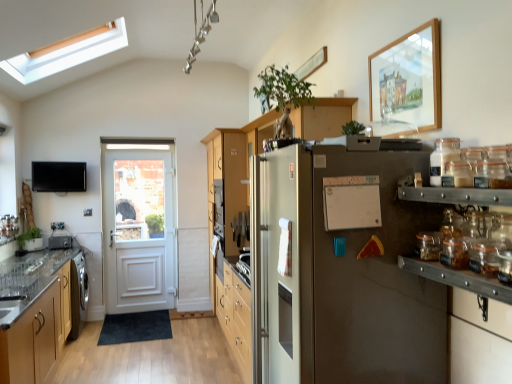
This screenshot has width=512, height=384. In order to click on wooden cabinet at left in this screenshot , I will do `click(35, 315)`.

What do you see at coordinates (429, 245) in the screenshot? This screenshot has height=384, width=512. I see `clear glass jar at right, which is counted as the 1th glass jar, starting from the bottom` at bounding box center [429, 245].

Locate an element on the screen. The height and width of the screenshot is (384, 512). wooden picture frame at upper right is located at coordinates (407, 82).

What do you see at coordinates (343, 272) in the screenshot? Image resolution: width=512 pixels, height=384 pixels. I see `satin silver refrigerator at center` at bounding box center [343, 272].

You are a GUI agent. You are given a task and a screenshot of the screen. Output one action in this format:
    pyautogui.click(x=<x>, y=<y>)
    Task: Click on the metallic silver toaster at left
    The image size is (512, 384).
    Given the screenshot: What is the action you would take?
    pyautogui.click(x=60, y=242)

Between clear glass jar at right, the second glass jar in the top-to-bottom sequence, and wooden cabinet at left, which one has larger size?

wooden cabinet at left is bigger.

Is clear glass jar at right, the second glass jar in the top-to-bottom sequence, facing away from wooden cabinet at left?

No, clear glass jar at right, the second glass jar in the top-to-bottom sequence, is not facing away from wooden cabinet at left.

Is clear glass jar at right, which is counted as the 1th glass jar, starting from the bottom, positioned far away from wooden cabinet at left?

Yes.

From their relative heights in the image, would you say clear glass jar at right, which is counted as the 1th glass jar, starting from the bottom, is taller or shorter than wooden cabinet at left?

In the image, clear glass jar at right, which is counted as the 1th glass jar, starting from the bottom, appears to be shorter than wooden cabinet at left.

Looking at their sizes, would you say white matte bulletin board at center is wider or thinner than clear glass door at left?

white matte bulletin board at center is thinner than clear glass door at left.

Considering the positions of objects white matte bulletin board at center and clear glass door at left in the image provided, who is behind, white matte bulletin board at center or clear glass door at left?

Positioned behind is clear glass door at left.

From a real-world perspective, who is located lower, white matte bulletin board at center or clear glass door at left?

clear glass door at left.

Considering the relative sizes of clear glass jar at right, which is counted as the 1th glass jar, starting from the bottom, and green matte plant at left in the image provided, is clear glass jar at right, which is counted as the 1th glass jar, starting from the bottom, wider than green matte plant at left?

In fact, clear glass jar at right, which is counted as the 1th glass jar, starting from the bottom, might be narrower than green matte plant at left.

Which point is more distant from viewer, (432, 247) or (27, 234)?

The point (27, 234) is farther.

Considering the sizes of clear glass jar at right, the second glass jar in the top-to-bottom sequence, and green matte plant at left in the image, is clear glass jar at right, the second glass jar in the top-to-bottom sequence, taller or shorter than green matte plant at left?

Clearly, clear glass jar at right, the second glass jar in the top-to-bottom sequence, is shorter compared to green matte plant at left.

Considering the relative sizes of wooden cabinet at left and green matte plant at left in the image provided, is wooden cabinet at left smaller than green matte plant at left?

No.

In the scene shown: Is wooden cabinet at left not near green matte plant at left?

wooden cabinet at left is positioned a significant distance from green matte plant at left.

Which object is further away from the camera, wooden cabinet at left or green matte plant at left?

green matte plant at left is behind.

Is green matte plant at left a part of wooden cabinet at left?

No, wooden cabinet at left does not contain green matte plant at left.

Is wooden picture frame at upper right not near clear glass door at left?

Absolutely, wooden picture frame at upper right is distant from clear glass door at left.

Can you confirm if wooden picture frame at upper right is taller than clear glass door at left?

In fact, wooden picture frame at upper right may be shorter than clear glass door at left.

Considering the sizes of wooden picture frame at upper right and clear glass door at left in the image, is wooden picture frame at upper right wider or thinner than clear glass door at left?

Clearly, wooden picture frame at upper right has less width compared to clear glass door at left.

Which is more to the left, wooden picture frame at upper right or clear glass door at left?

clear glass door at left is more to the left.

From the image's perspective, is satin silver refrigerator at center beneath wooden cabinet at left?

No, from the image's perspective, satin silver refrigerator at center is not beneath wooden cabinet at left.

From a real-world perspective, relative to wooden cabinet at left, is satin silver refrigerator at center vertically above or below?

satin silver refrigerator at center is situated higher than wooden cabinet at left in the real world.

Considering the sizes of objects satin silver refrigerator at center and wooden cabinet at left in the image provided, who is thinner, satin silver refrigerator at center or wooden cabinet at left?

wooden cabinet at left is thinner.

Which is closer to the camera, (339, 360) or (60, 297)?

Clearly, point (339, 360) is closer to the camera than point (60, 297).

Does clear glass jar at upper right, acting as the 1th glass jar starting from the top, have a lesser width compared to green matte plant at left?

Yes, clear glass jar at upper right, acting as the 1th glass jar starting from the top, is thinner than green matte plant at left.

Considering the sizes of objects clear glass jar at upper right, the 2th glass jar ordered from the bottom, and green matte plant at left in the image provided, who is taller, clear glass jar at upper right, the 2th glass jar ordered from the bottom, or green matte plant at left?

Standing taller between the two is green matte plant at left.

Does point (460, 158) come closer to viewer compared to point (36, 233)?

Yes, it is in front of point (36, 233).

The height and width of the screenshot is (384, 512). I want to click on plant below the clear glass jar at upper right, acting as the 1th glass jar starting from the top (from the image's perspective), so click(x=28, y=236).

Image resolution: width=512 pixels, height=384 pixels. There is a wooden cabinet at left. Identify the location of the 1st glass jar above it (from the image's perspective). (429, 245).

Identify the location of window screen behind the white matte bulletin board at center. Image resolution: width=512 pixels, height=384 pixels. (139, 199).

When comparing their distances from white matte bulletin board at center, does green matte plant at left or satin silver refrigerator at center seem closer?

satin silver refrigerator at center is positioned closer to the anchor white matte bulletin board at center.

Which object lies further to the anchor point clear glass jar at right, which is counted as the 1th glass jar, starting from the bottom, clear glass jar at upper right, the 2th glass jar ordered from the bottom, or metallic silver toaster at left?

metallic silver toaster at left is further to clear glass jar at right, which is counted as the 1th glass jar, starting from the bottom.

Estimate the real-world distances between objects in this image. Which object is closer to wooden cabinet at left, clear glass jar at right, the second glass jar in the top-to-bottom sequence, or white matte bulletin board at center?

The object closer to wooden cabinet at left is white matte bulletin board at center.

Looking at the image, which one is located further to metallic silver toaster at left, clear glass door at left or white matte bulletin board at center?

white matte bulletin board at center.

Based on their spatial positions, is clear glass door at left or metallic silver toaster at left closer to white matte bulletin board at center?

metallic silver toaster at left.

Based on their spatial positions, is satin silver refrigerator at center or metallic silver toaster at left further from white matte bulletin board at center?

Based on the image, metallic silver toaster at left appears to be further to white matte bulletin board at center.

Estimate the real-world distances between objects in this image. Which object is further from clear glass jar at upper right, acting as the 1th glass jar starting from the top, metallic silver toaster at left or clear glass door at left?

metallic silver toaster at left is positioned further to the anchor clear glass jar at upper right, acting as the 1th glass jar starting from the top.

From the picture: Estimate the real-world distances between objects in this image. Which object is closer to satin silver refrigerator at center, metallic silver toaster at left or wooden cabinet at left?

wooden cabinet at left is positioned closer to the anchor satin silver refrigerator at center.

Locate an element on the screen. plant positioned between clear glass jar at right, the second glass jar in the top-to-bottom sequence, and clear glass door at left from near to far is located at coordinates (28, 236).

Locate an element on the screen. plant positioned between clear glass jar at right, the second glass jar in the top-to-bottom sequence, and metallic silver toaster at left from near to far is located at coordinates (28, 236).

Locate an element on the screen. cabinetry between green matte plant at left and satin silver refrigerator at center in the horizontal direction is located at coordinates (35, 315).

In order to click on glass jar between white matte bulletin board at center and clear glass jar at upper right, the 2th glass jar ordered from the bottom, in the horizontal direction in this screenshot , I will do `click(429, 245)`.